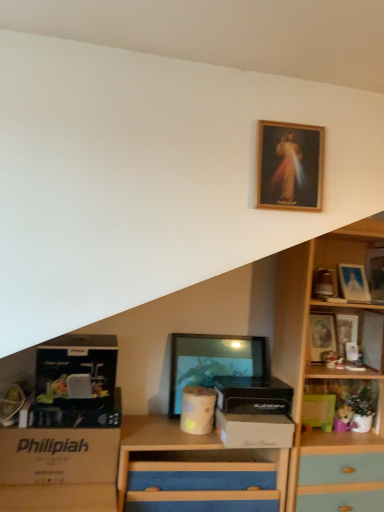
You are a GUI agent. You are given a task and a screenshot of the screen. Output one action in this format:
    pyautogui.click(x=<x>, y=<y>)
    Task: Click on the white cardboard box at center, the 1th storage box when ordered from right to left
    
    Given the screenshot: What is the action you would take?
    pyautogui.click(x=254, y=430)

Describe the element at coordinates (213, 362) in the screenshot. I see `matte black picture frame at center, positioned as the 1th picture frame in left-to-right order` at that location.

What is the approximate width of black plastic box at center, which is the second box from right to left?

8.74 inches.

Find the location of a particular element. blue fabric chest of drawers at center is located at coordinates (x=194, y=471).

Find the location of a particular element. wooden picture frame at upper right, positioned as the first picture frame in right-to-left order is located at coordinates (375, 273).

Where is `white cardboard box at center, the 1th storage box when ordered from right to left`? white cardboard box at center, the 1th storage box when ordered from right to left is located at coordinates (254, 430).

Does point (338, 350) appear closer or farther from the camera than point (208, 383)?

Point (338, 350) is farther from the camera than point (208, 383).

Could you tell me if wooden picture frame at upper right, which is the fourth picture frame from left to right, is facing matte black picture frame at center, which is the fourth picture frame in back-to-front order?

No, wooden picture frame at upper right, which is the fourth picture frame from left to right, is not facing towards matte black picture frame at center, which is the fourth picture frame in back-to-front order.

Is wooden picture frame at upper right, placed as the first picture frame when sorted from back to front, in front of or behind matte black picture frame at center, positioned as the 1th picture frame in left-to-right order, in the image?

In the image, wooden picture frame at upper right, placed as the first picture frame when sorted from back to front, appears behind matte black picture frame at center, positioned as the 1th picture frame in left-to-right order.

Which is behind, matte gold picture frame at upper right, which is the third picture frame in back-to-front order, or white cardboard box at lower left, arranged as the first storage box when viewed from the left?

matte gold picture frame at upper right, which is the third picture frame in back-to-front order, is further from the camera.

Looking at this image, which object is thinner, matte gold picture frame at upper right, the 3th picture frame positioned from the left, or white cardboard box at lower left, which is the second storage box from right to left?

matte gold picture frame at upper right, the 3th picture frame positioned from the left.

From a real-world perspective, between matte gold picture frame at upper right, which is the third picture frame in back-to-front order, and white cardboard box at lower left, which is the second storage box from right to left, who is vertically higher?

matte gold picture frame at upper right, which is the third picture frame in back-to-front order, is physically above.

Can you tell me how much wooden picture frame at upper center, positioned as the first picture frame in front-to-back order, and matte silver picture frame at upper right, the second picture frame from the right, differ in facing direction?

0.00903 degrees.

Is wooden picture frame at upper center, the 6th picture frame positioned from the back, closer to camera compared to matte silver picture frame at upper right, the second picture frame from the right?

Yes.

Is wooden picture frame at upper center, the 5th picture frame from the right, turned away from matte silver picture frame at upper right, placed as the 5th picture frame when sorted from front to back?

wooden picture frame at upper center, the 5th picture frame from the right, is not turned away from matte silver picture frame at upper right, placed as the 5th picture frame when sorted from front to back.

Considering the sizes of objects wooden picture frame at upper center, the 5th picture frame from the right, and matte silver picture frame at upper right, the 5th picture frame from the left, in the image provided, who is shorter, wooden picture frame at upper center, the 5th picture frame from the right, or matte silver picture frame at upper right, the 5th picture frame from the left,?

matte silver picture frame at upper right, the 5th picture frame from the left.

Who is shorter, white cardboard box at lower left, the third box from the right, or white cardboard box at center, the 1th storage box when ordered from right to left?

With less height is white cardboard box at center, the 1th storage box when ordered from right to left.

There is a white cardboard box at lower left, the third box from the right. Where is `the 1st storage box below it (from a real-world perspective)`? The image size is (384, 512). the 1st storage box below it (from a real-world perspective) is located at coordinates (254, 430).

From the image's perspective, is white cardboard box at lower left, the third box from the right, on white cardboard box at center, marked as the 2th storage box in a left-to-right arrangement?

Yes, from the image's perspective, white cardboard box at lower left, the third box from the right, is over white cardboard box at center, marked as the 2th storage box in a left-to-right arrangement.

Considering the points (37, 382) and (291, 426), which point is in front, point (37, 382) or point (291, 426)?

Positioned in front is point (37, 382).

Considering the relative positions of white cardboard box at lower left, positioned as the first box in left-to-right order, and matte silver picture frame at upper right, the 2th picture frame in the back-to-front sequence, in the image provided, is white cardboard box at lower left, positioned as the first box in left-to-right order, to the left or to the right of matte silver picture frame at upper right, the 2th picture frame in the back-to-front sequence,?

In the image, white cardboard box at lower left, positioned as the first box in left-to-right order, appears on the left side of matte silver picture frame at upper right, the 2th picture frame in the back-to-front sequence.

Between white cardboard box at lower left, which is counted as the 1th box, starting from the top, and matte silver picture frame at upper right, placed as the 5th picture frame when sorted from front to back, which one has less height?

white cardboard box at lower left, which is counted as the 1th box, starting from the top.

Which of these two, white cardboard box at lower left, which is counted as the 1th box, starting from the top, or matte silver picture frame at upper right, the 2th picture frame in the back-to-front sequence, is bigger?

With larger size is white cardboard box at lower left, which is counted as the 1th box, starting from the top.

In the image, is white cardboard box at lower left, which is counted as the 1th box, starting from the top, positioned in front of or behind matte silver picture frame at upper right, the 5th picture frame from the left?

white cardboard box at lower left, which is counted as the 1th box, starting from the top, is in front of matte silver picture frame at upper right, the 5th picture frame from the left.

Which is more to the right, matte silver picture frame at upper right, the 2th picture frame in the back-to-front sequence, or white cardboard box at lower left, which is counted as the 1th box, starting from the top?

matte silver picture frame at upper right, the 2th picture frame in the back-to-front sequence, is more to the right.

Looking at this image, is matte silver picture frame at upper right, the 5th picture frame from the left, oriented away from white cardboard box at lower left, positioned as the first box in left-to-right order?

No, white cardboard box at lower left, positioned as the first box in left-to-right order, is not at the back of matte silver picture frame at upper right, the 5th picture frame from the left.

From the image's perspective, is matte silver picture frame at upper right, placed as the 5th picture frame when sorted from front to back, over white cardboard box at lower left, which is counted as the 1th box, starting from the top?

Yes.

Based on the photo, which is more to the left, white cardboard box at center, the 1th storage box when ordered from right to left, or green matte box at lower right, the 1th box in the right-to-left sequence?

From the viewer's perspective, white cardboard box at center, the 1th storage box when ordered from right to left, appears more on the left side.

Considering their positions, is white cardboard box at center, marked as the 2th storage box in a left-to-right arrangement, located in front of or behind green matte box at lower right, the 1th box in the right-to-left sequence?

Visually, white cardboard box at center, marked as the 2th storage box in a left-to-right arrangement, is located in front of green matte box at lower right, the 1th box in the right-to-left sequence.

From the picture: Is white cardboard box at center, the 1th storage box when ordered from right to left, shorter than green matte box at lower right, the 1th box in the right-to-left sequence?

Yes, white cardboard box at center, the 1th storage box when ordered from right to left, is shorter than green matte box at lower right, the 1th box in the right-to-left sequence.

Which of these two, white cardboard box at center, marked as the 2th storage box in a left-to-right arrangement, or green matte box at lower right, positioned as the third box in top-to-bottom order, is wider?

With larger width is white cardboard box at center, marked as the 2th storage box in a left-to-right arrangement.

Locate an element on the screen. Image resolution: width=384 pixels, height=512 pixels. picture frame below the wooden picture frame at upper right, placed as the first picture frame when sorted from back to front (from a real-world perspective) is located at coordinates (213, 362).

Image resolution: width=384 pixels, height=512 pixels. Find the location of `the 2nd storage box below the matte gold picture frame at upper right, placed as the 4th picture frame when sorted from right to left (from the image's perspective)`. the 2nd storage box below the matte gold picture frame at upper right, placed as the 4th picture frame when sorted from right to left (from the image's perspective) is located at coordinates (61, 453).

Which object lies further to the anchor point wooden picture frame at upper center, the 6th picture frame positioned from the back, black plastic box at center, marked as the 2th box in a left-to-right arrangement, or green matte box at lower right, which is counted as the 1th box, starting from the bottom?

green matte box at lower right, which is counted as the 1th box, starting from the bottom.

Which object lies nearer to the anchor point matte silver picture frame at upper right, the 2th picture frame in the back-to-front sequence, blue fabric chest of drawers at center or wooden picture frame at upper center, the 6th picture frame positioned from the back?

blue fabric chest of drawers at center.

Estimate the real-world distances between objects in this image. Which object is further from wooden picture frame at upper center, the 6th picture frame positioned from the back, green matte box at lower right, which is counted as the 1th box, starting from the bottom, or black plastic box at center, the second box in the top-to-bottom sequence?

green matte box at lower right, which is counted as the 1th box, starting from the bottom, lies further to wooden picture frame at upper center, the 6th picture frame positioned from the back, than the other object.

Looking at this image, which object lies further to the anchor point black plastic box at center, which is the second box from right to left, wooden picture frame at upper center, the 5th picture frame from the right, or blue fabric chest of drawers at center?

wooden picture frame at upper center, the 5th picture frame from the right, is positioned further to the anchor black plastic box at center, which is the second box from right to left.

Which object lies nearer to the anchor point matte silver picture frame at upper right, the 5th picture frame from the left, white cardboard box at lower left, positioned as the first box in left-to-right order, or wooden picture frame at upper right, which is the fourth picture frame from left to right?

wooden picture frame at upper right, which is the fourth picture frame from left to right, is positioned closer to the anchor matte silver picture frame at upper right, the 5th picture frame from the left.

Which object lies nearer to the anchor point wooden picture frame at upper right, placed as the 2th picture frame when sorted from front to back, black plastic box at center, placed as the 2th box when sorted from bottom to top, or wooden picture frame at upper center, positioned as the first picture frame in front-to-back order?

Among the two, black plastic box at center, placed as the 2th box when sorted from bottom to top, is located nearer to wooden picture frame at upper right, placed as the 2th picture frame when sorted from front to back.

When comparing their distances from white cardboard box at lower left, which is the second storage box from right to left, does matte gold picture frame at upper right, the 3th picture frame positioned from the left, or matte silver picture frame at upper right, the 2th picture frame in the back-to-front sequence, seem closer?

matte gold picture frame at upper right, the 3th picture frame positioned from the left, is positioned closer to the anchor white cardboard box at lower left, which is the second storage box from right to left.

Which object lies further to the anchor point black plastic box at center, marked as the 2th box in a left-to-right arrangement, matte black picture frame at center, the 6th picture frame when ordered from right to left, or matte gold picture frame at upper right, placed as the 4th picture frame when sorted from right to left?

The object further to black plastic box at center, marked as the 2th box in a left-to-right arrangement, is matte gold picture frame at upper right, placed as the 4th picture frame when sorted from right to left.

Identify the location of chest of drawers between white cardboard box at lower left, which is the second storage box from right to left, and black plastic box at center, which is the second box from right to left. Image resolution: width=384 pixels, height=512 pixels. (194, 471).

The width and height of the screenshot is (384, 512). I want to click on box between white cardboard box at lower left, which is the second storage box from right to left, and blue fabric chest of drawers at center, in the horizontal direction, so click(x=76, y=371).

Where is `storage box between white cardboard box at lower left, which is the second storage box from right to left, and black plastic box at center, which is the second box from right to left, in the horizontal direction`? The image size is (384, 512). storage box between white cardboard box at lower left, which is the second storage box from right to left, and black plastic box at center, which is the second box from right to left, in the horizontal direction is located at coordinates (254, 430).

Locate an element on the screen. Image resolution: width=384 pixels, height=512 pixels. storage box located between white cardboard box at lower left, which is counted as the 1th box, starting from the top, and matte gold picture frame at upper right, arranged as the fourth picture frame when viewed from the front, in the left-right direction is located at coordinates pyautogui.click(x=254, y=430).